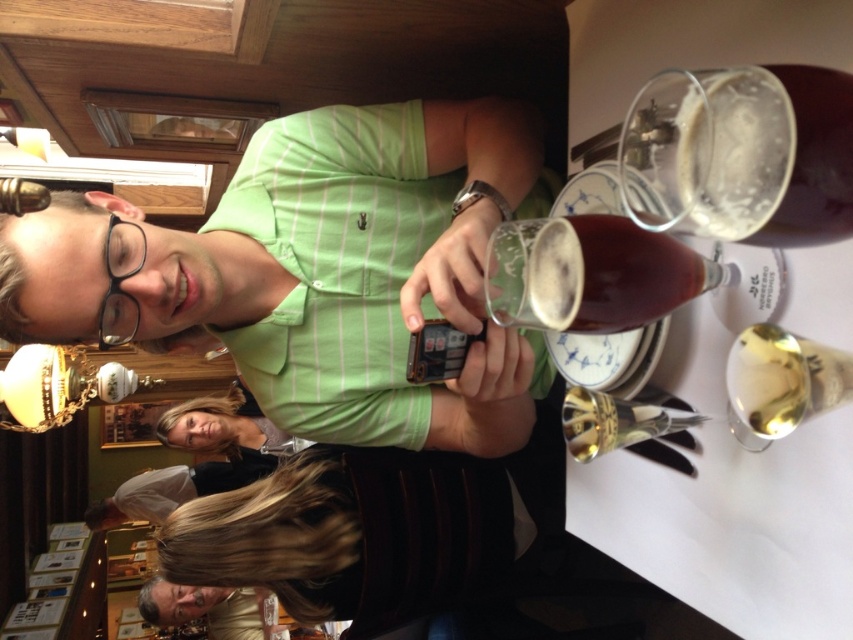
You are a bartender who needs to place a 5.5 inch long cocktail shaker between the brown matte glass at upper center and the translucent glass at upper right. Can you fit it there?

The distance between the brown matte glass at upper center and the translucent glass at upper right is 4.67 inches, which is shorter than the 5.5 inch cocktail shaker. Therefore, the shaker cannot fit in that space.

You are a photographer who just took a rotated photo of a social gathering. In the image, you see a green striped shirt at center and a clear glass at upper right. Which object is more to the left?

The green striped shirt at center is more to the left because it is positioned on the left side of the clear glass at upper right.